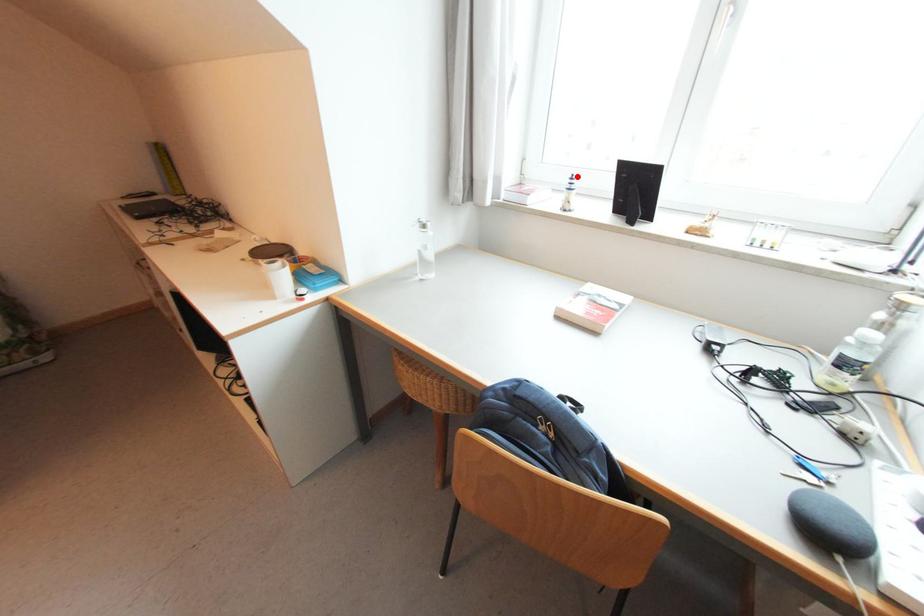
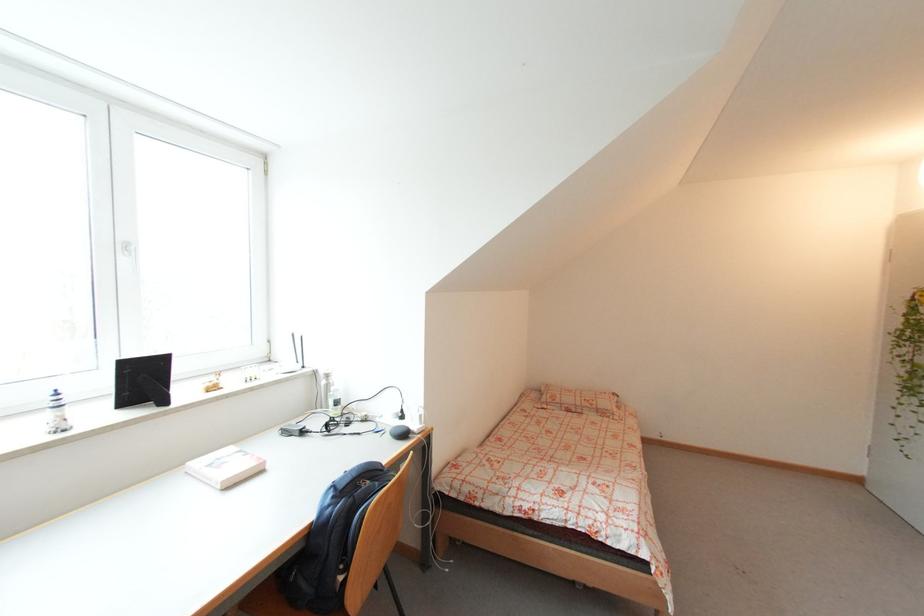
The point at the highlighted location is marked in the first image. Where is the corresponding point in the second image?

(58, 392)